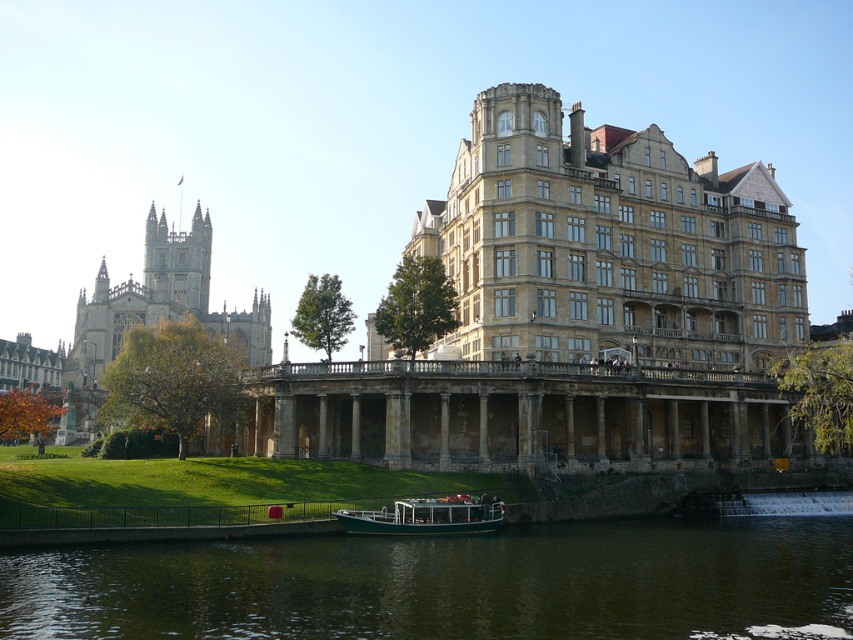
Question: Considering the relative positions of green water at lower center and green polished wood boat at lower center in the image provided, where is green water at lower center located with respect to green polished wood boat at lower center?

Choices:
 (A) below
 (B) above

Answer: (A)

Question: Considering the relative positions of green water at lower center and green polished wood boat at lower center in the image provided, where is green water at lower center located with respect to green polished wood boat at lower center?

Choices:
 (A) above
 (B) below

Answer: (B)

Question: Is green water at lower center thinner than green polished wood boat at lower center?

Choices:
 (A) no
 (B) yes

Answer: (A)

Question: Which object is farther from the camera taking this photo?

Choices:
 (A) green water at lower center
 (B) green polished wood boat at lower center

Answer: (B)

Question: Which of the following is the closest to the observer?

Choices:
 (A) green polished wood boat at lower center
 (B) green water at lower center

Answer: (B)